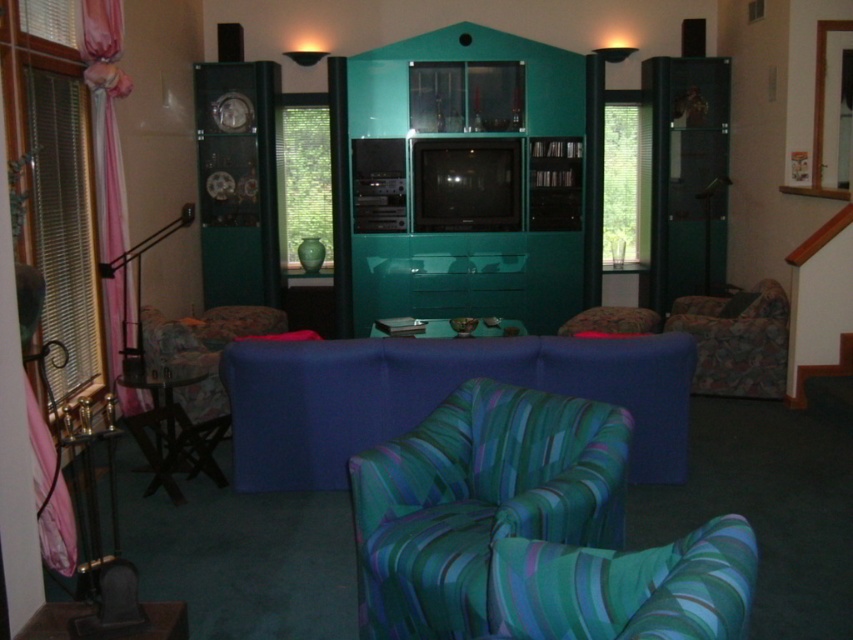
Question: Which of the following is the farthest from the observer?

Choices:
 (A) patterned fabric armchair at right
 (B) blue fabric couch at lower left
 (C) green striped fabric chair at lower center

Answer: (A)

Question: Can you confirm if metallic silver tray at center is positioned to the right of teal glossy vase at center?

Choices:
 (A) no
 (B) yes

Answer: (B)

Question: Is green striped fabric chair at lower center wider than blue fabric couch at lower left?

Choices:
 (A) no
 (B) yes

Answer: (A)

Question: Which object appears closest to the camera in this image?

Choices:
 (A) patterned fabric armchair at right
 (B) green striped fabric chair at lower center
 (C) blue fabric couch at lower left
 (D) teal glossy entertainment center at center

Answer: (B)

Question: Among these objects, which one is nearest to the camera?

Choices:
 (A) green striped fabric armchair at lower center
 (B) metallic silver tray at center
 (C) patterned fabric armchair at right

Answer: (A)

Question: Is teal glossy entertainment center at center in front of teal glossy vase at center?

Choices:
 (A) yes
 (B) no

Answer: (A)